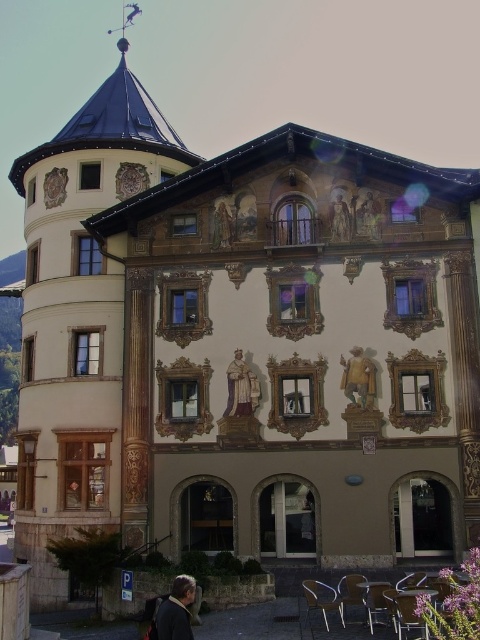
Between wooden statue at center and gold ornate statue at center, which one appears on the left side from the viewer's perspective?

gold ornate statue at center

Is the position of wooden statue at center less distant than that of gold ornate statue at center?

Yes, wooden statue at center is in front of gold ornate statue at center.

Locate an element on the screen. The height and width of the screenshot is (640, 480). wooden statue at center is located at coordinates (358, 378).

Find the location of `wooden statue at center`. wooden statue at center is located at coordinates (358, 378).

Is golden textured statue at center bigger than gold leaf painting at upper center?

Correct, golden textured statue at center is larger in size than gold leaf painting at upper center.

Is point (259, 397) more distant than point (214, 236)?

That is False.

You are a GUI agent. You are given a task and a screenshot of the screen. Output one action in this format:
    pyautogui.click(x=<x>, y=<y>)
    Task: Click on the golden textured statue at center
    The width and height of the screenshot is (480, 640).
    Given the screenshot: What is the action you would take?
    pyautogui.click(x=240, y=387)

Which is more to the left, gold leaf painting at upper center or gold ornate statue at center?

gold leaf painting at upper center

Consider the image. Which is below, gold leaf painting at upper center or gold ornate statue at center?

gold leaf painting at upper center is below.

The height and width of the screenshot is (640, 480). Identify the location of gold leaf painting at upper center. 222,225.

You are a GUI agent. You are given a task and a screenshot of the screen. Output one action in this format:
    pyautogui.click(x=<x>, y=<y>)
    Task: Click on the gold leaf painting at upper center
    The image size is (480, 640).
    Given the screenshot: What is the action you would take?
    pyautogui.click(x=222, y=225)